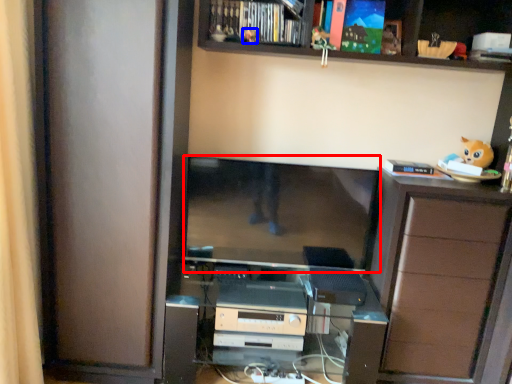
Question: Which of the following is the closest to the observer, computer monitor (highlighted by a red box) or toy (highlighted by a blue box)?

Choices:
 (A) computer monitor
 (B) toy

Answer: (B)